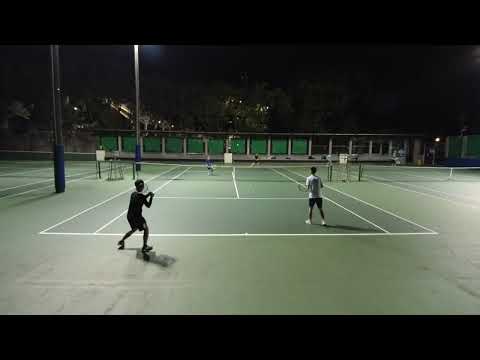
Locate an element on the screen. The image size is (480, 360). lights is located at coordinates (77, 109).